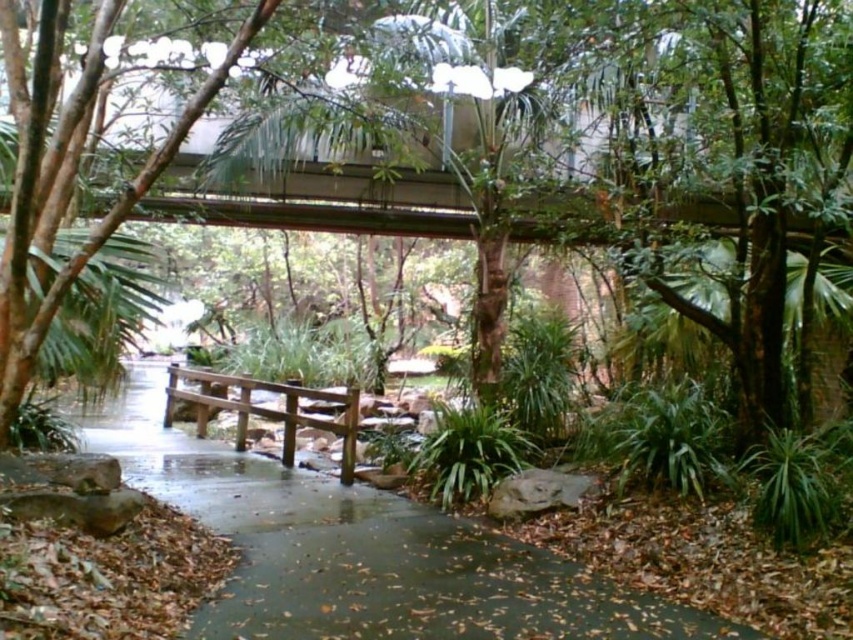
You are a maintenance worker needing to inspect both the brown wooden bridge at center and the brown wooden bench at center. If your tool kit is 2.5 meters long, can you lay it flat between them without it touching the ground?

The distance between the brown wooden bridge at center and the brown wooden bench at center is 3.13 meters. Since the tool kit is 2.5 meters long, it can be laid flat between them without touching the ground as the distance is sufficient.

You are standing on the walkway and want to locate the green leafy tree at center. According to the coordinates provided, where should you look relative to your current position?

The green leafy tree at center is located at coordinates point (599,150), so you should look towards the lower left direction from your current position on the walkway.

You are standing on the modern walkway and see the green leafy tree at center and the brown wooden bench at center. Which object is located to the right of the other?

The green leafy tree at center is positioned on the right side of brown wooden bench at center, so the tree is to the right of the bench.